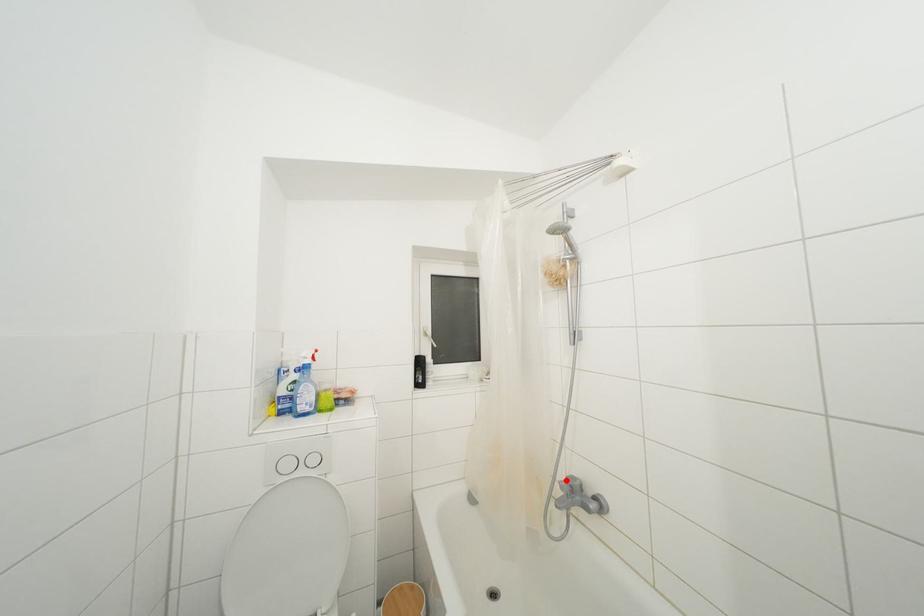
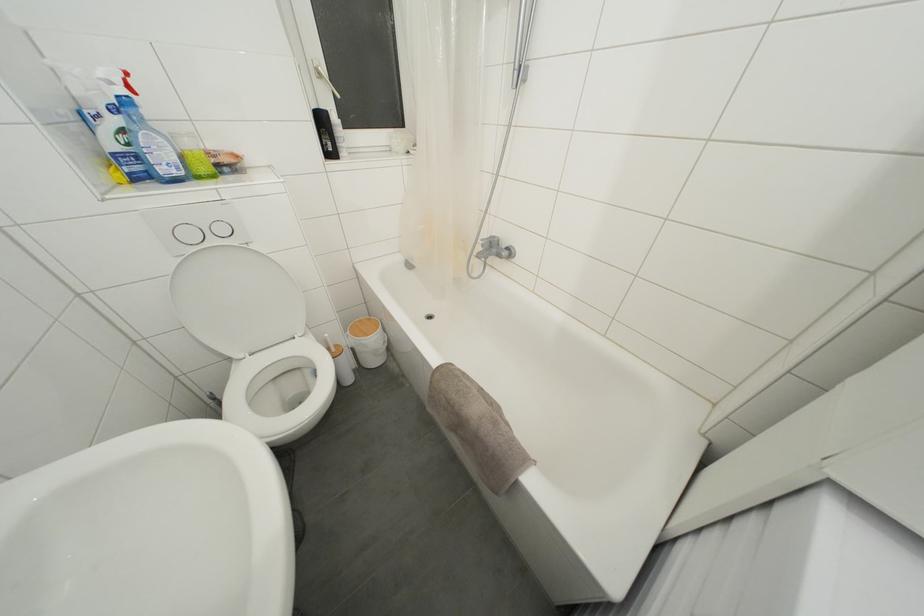
Question: I am providing you with two images of the same scene from different viewpoints. Image1 has a red point marked. In image2, the corresponding 3D location appears at what relative position? Reply with the corresponding letter.

Choices:
 (A) Closer
 (B) Farther

Answer: (A)